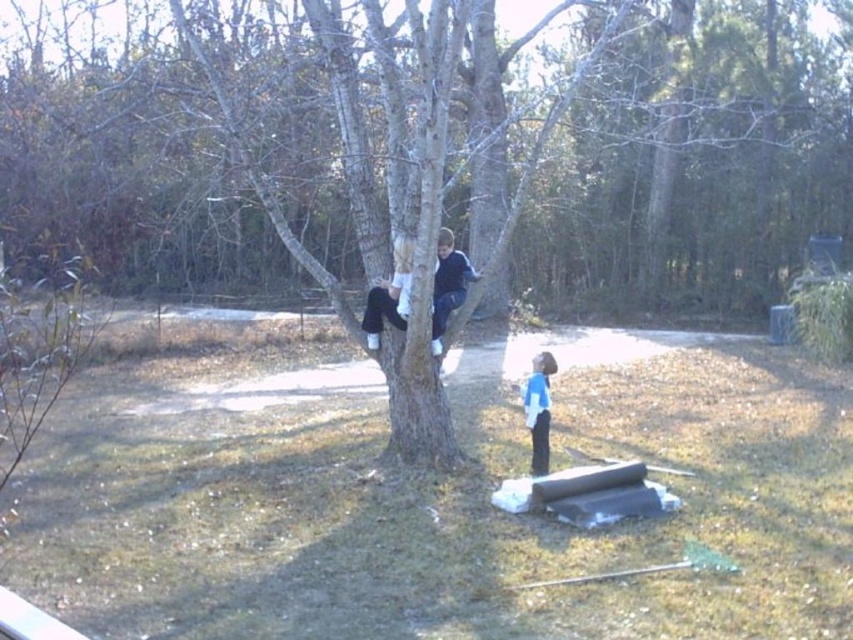
You are planning to set up a picnic blanket in the backyard. The picnic blanket requires a flat area with grass that is shorter than the blue fleece jacket at tree. Based on the scene, is the brown grass at lower center suitable for placing the picnic blanket?

The brown grass at lower center is not as tall as the blue fleece jacket at tree, so it is suitable for placing the picnic blanket since the grass there is shorter than the jacket.

Looking at this image, you are standing at the center of the backyard and want to place a small garden ornament on the brown grass at lower center. According to the coordinates provided, what are the exact coordinates where you should place it?

The brown grass at lower center is located at point (440, 500), so you should place the garden ornament at those coordinates.

You are planning to place a small garden statue in the backyard scene. The statue requires a flat surface that is higher than the brown grass at lower center. Can you use the area where the blue fleece jacket at tree is located for this purpose?

The brown grass at lower center is located below blue fleece jacket at tree, which means the blue fleece jacket at tree is positioned higher. Therefore, the area where the blue fleece jacket at tree is located would provide a suitable elevated flat surface for placing the garden statue.